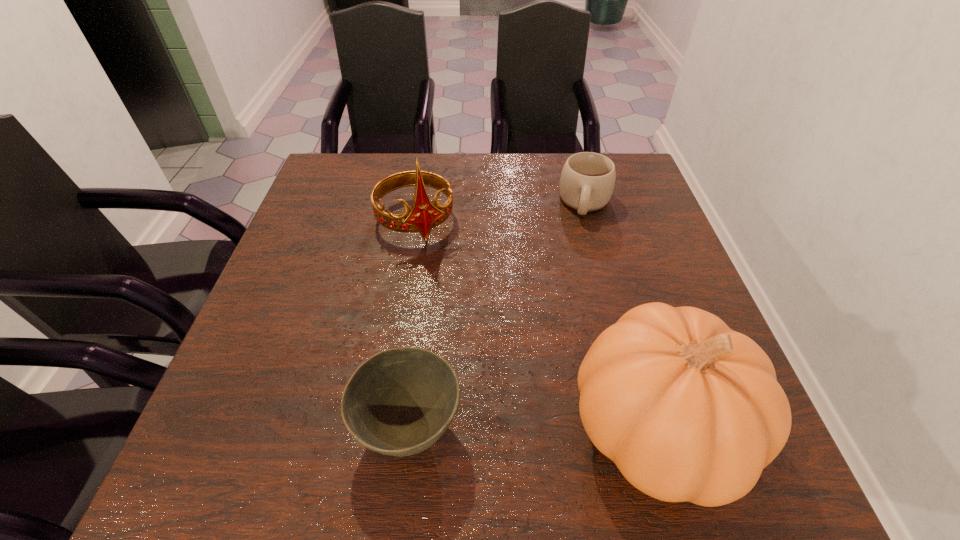
The width and height of the screenshot is (960, 540). I want to click on free spot on the desktop that is between the bowl and the pumpkin and is positioned on the side of the mug with the handle, so click(553, 429).

At what (x,y) coordinates should I click in order to perform the action: click on vacant spot on the desktop that is between the bowl and the pumpkin and is positioned on the front-facing side of the tiara. Please return your answer as a coordinate pair (x, y). Looking at the image, I should click on (512, 429).